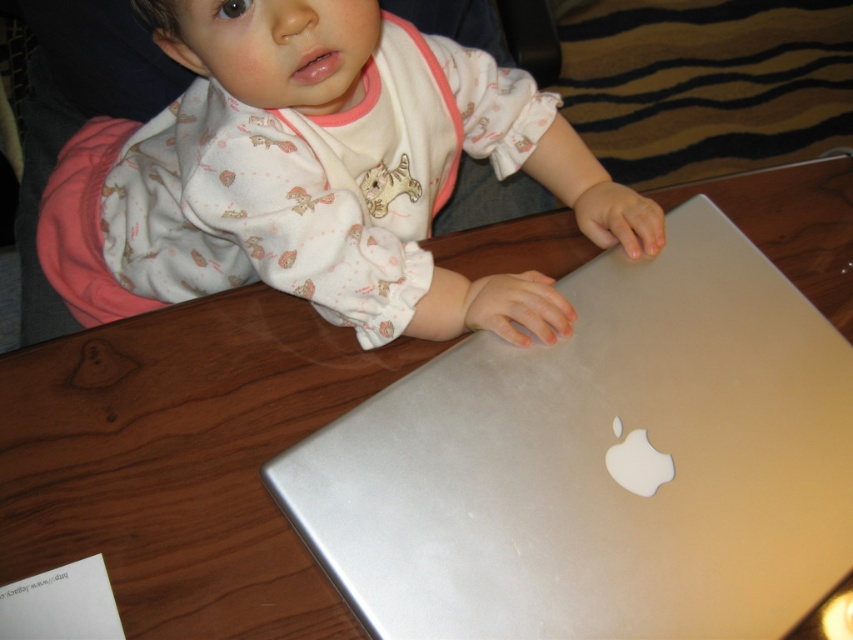
You are a photographer taking a picture of the silver metallic laptop at center and the matte white baby at upper left. Which object should you focus on first to ensure it appears sharp in the photo?

You should focus on the silver metallic laptop at center first because it is closer to the viewer than the matte white baby at upper left, so it requires proper focus to ensure sharpness.

You are a photographer taking a picture of the silver metallic laptop at center and the matte white baby at upper left. Which object should you focus on first if you want to capture both in the same frame without moving the camera?

You should focus on the matte white baby at upper left first because the silver metallic laptop at center is positioned to its right, so adjusting focus from left to right would naturally include both in the frame.

You are a photographer setting up for a photo shoot. You need to position a light source so that it illuminates both the silver metallic laptop at center and the matte white baby at upper left equally. Based on their positions, where should you place the light source relative to the two objects?

Since the silver metallic laptop at center is located below the matte white baby at upper left, placing the light source above and between them would ensure equal illumination on both objects.